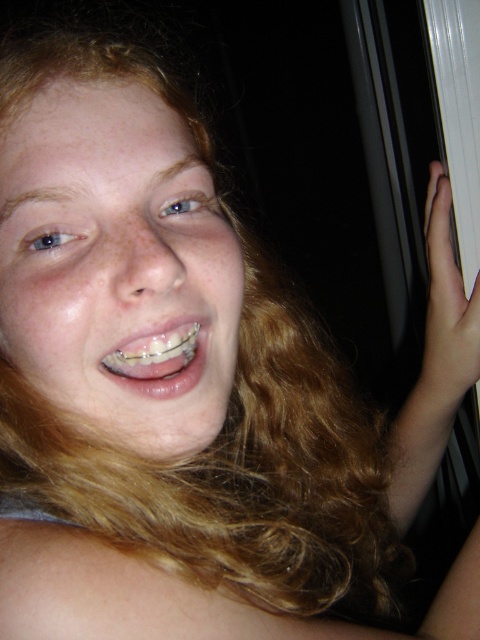
Question: Can you confirm if white matte hand at upper right is positioned above clear plastic braces at center?

Choices:
 (A) no
 (B) yes

Answer: (B)

Question: Which of the following is the farthest from the observer?

Choices:
 (A) white matte hand at upper right
 (B) clear plastic braces at center

Answer: (A)

Question: Is white matte hand at upper right thinner than clear plastic braces at center?

Choices:
 (A) no
 (B) yes

Answer: (A)

Question: Among these points, which one is farthest from the camera?

Choices:
 (A) (163, 390)
 (B) (442, 173)

Answer: (B)

Question: Can you confirm if white matte hand at upper right is thinner than clear plastic braces at center?

Choices:
 (A) yes
 (B) no

Answer: (B)